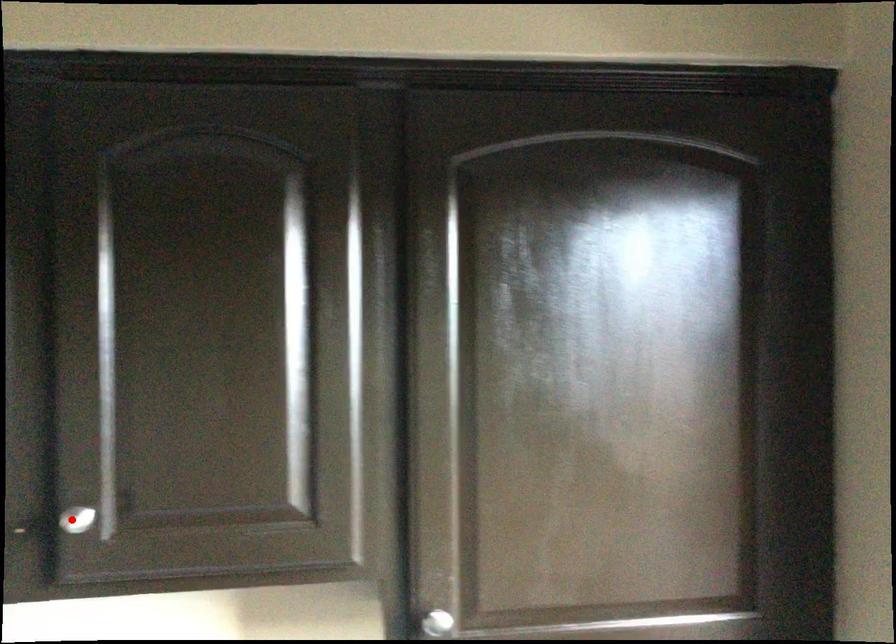
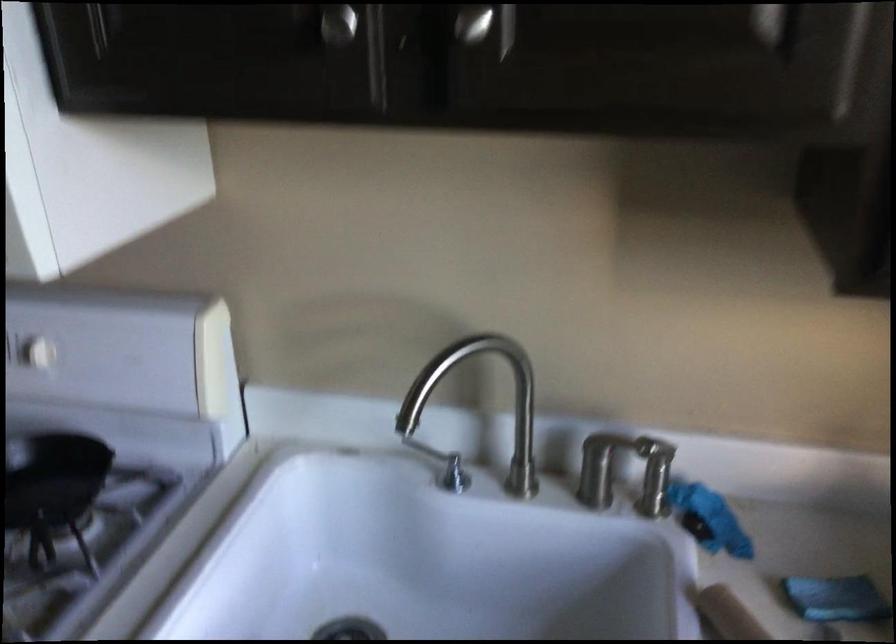
Question: I am providing you with two images of the same scene from different viewpoints. A red point is shown in image1. For the corresponding object point in image2, is it positioned nearer or farther from the camera?

Choices:
 (A) Nearer
 (B) Farther

Answer: (A)